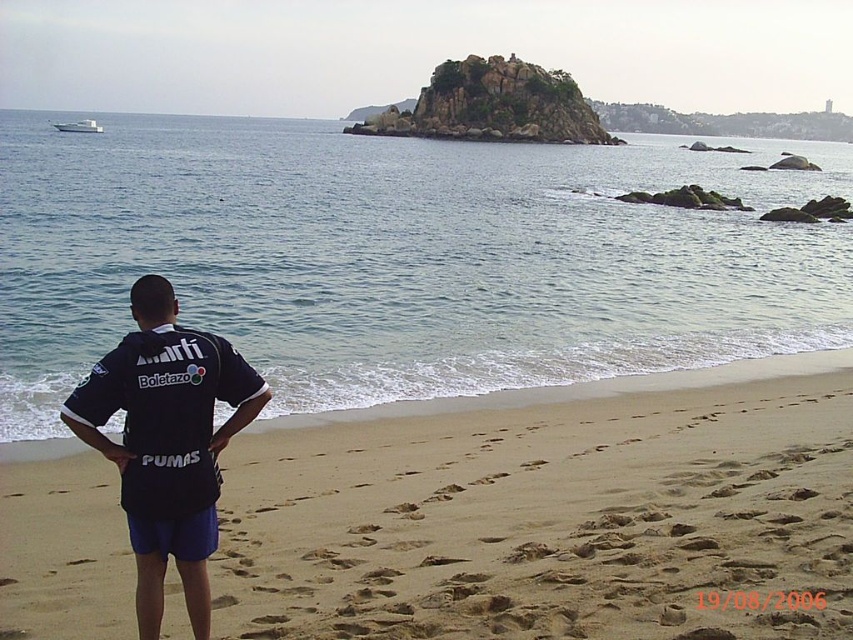
Question: Observing the image, what is the correct spatial positioning of sandy beach at lower left in reference to white glossy boat at upper left?

Choices:
 (A) right
 (B) left

Answer: (A)

Question: Where is blue water at center located in relation to white glossy boat at upper left in the image?

Choices:
 (A) below
 (B) above

Answer: (A)

Question: Which point appears closest to the camera in this image?

Choices:
 (A) (457, 182)
 (B) (201, 342)
 (C) (489, 563)
 (D) (88, 131)

Answer: (B)

Question: Considering the real-world distances, which object is farthest from the blue water at center?

Choices:
 (A) dark blue jersey at center
 (B) white glossy boat at upper left
 (C) sandy beach at lower left

Answer: (A)

Question: Which point appears closest to the camera in this image?

Choices:
 (A) (68, 131)
 (B) (376, 627)
 (C) (283, 291)
 (D) (160, 385)

Answer: (D)

Question: Is dark blue jersey at center bigger than white glossy boat at upper left?

Choices:
 (A) no
 (B) yes

Answer: (A)